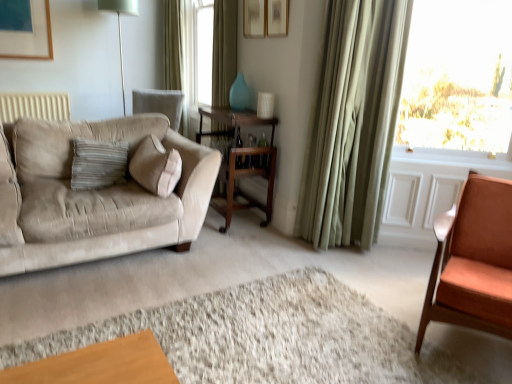
Question: In terms of width, does wooden table at center look wider or thinner when compared to matte white picture frame at upper center?

Choices:
 (A) wide
 (B) thin

Answer: (A)

Question: Is wooden table at center bigger or smaller than matte white picture frame at upper center?

Choices:
 (A) small
 (B) big

Answer: (B)

Question: Estimate the real-world distances between objects in this image. Which object is closer to the wooden table at center?

Choices:
 (A) beige suede couch at left
 (B) smooth orange chair at right
 (C) green fabric curtain at upper center, marked as the third curtain in a right-to-left arrangement
 (D) green fabric curtain at right, marked as the 1th curtain in a right-to-left arrangement
 (E) matte white picture frame at upper center

Answer: (D)

Question: Which object is the closest to the transparent glass window at upper right?

Choices:
 (A) matte white picture frame at upper center
 (B) beige suede couch at left
 (C) green fabric curtain at right, the first curtain positioned from the front
 (D) smooth orange chair at right
 (E) matte orange chair at right

Answer: (C)